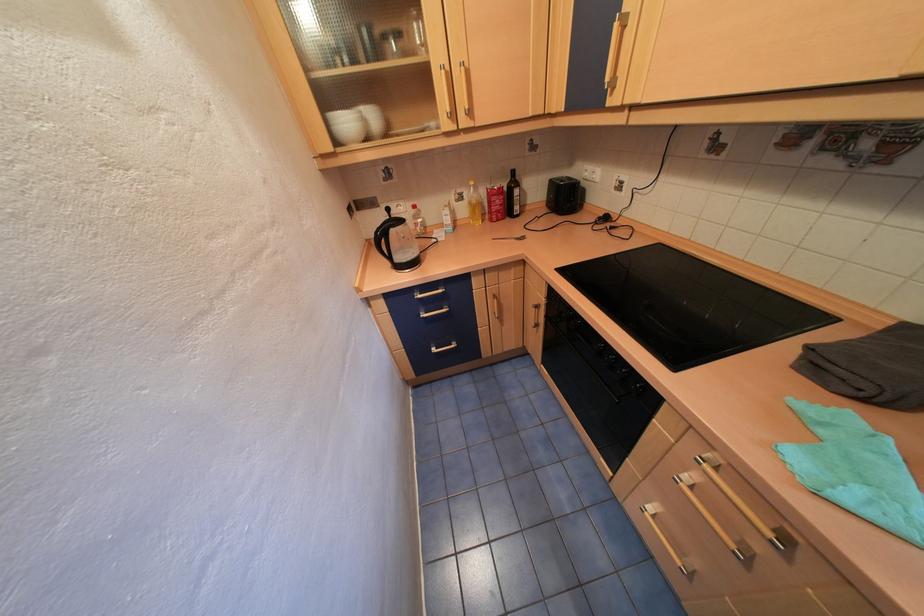
The image size is (924, 616). Find the location of `white bowl`. white bowl is located at coordinates point(346,126).